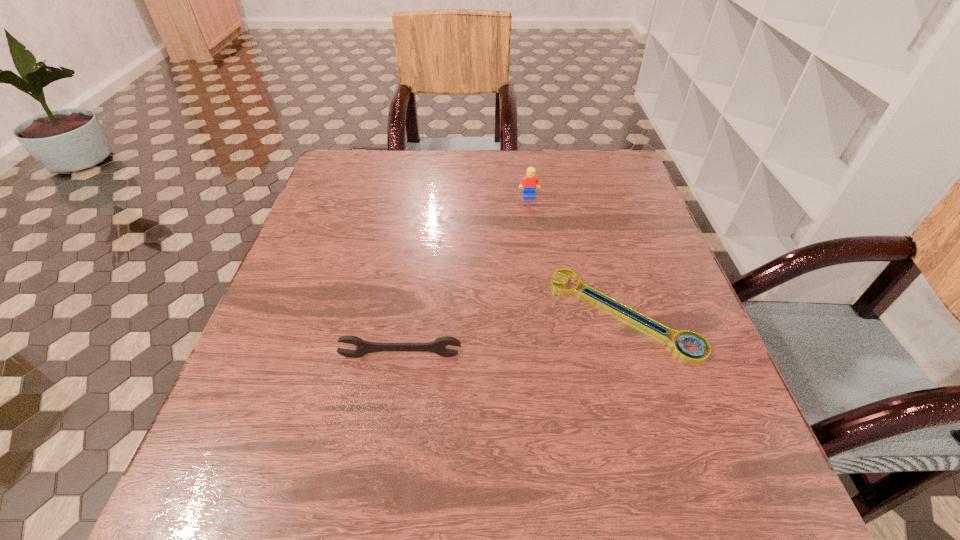
In order to click on object identified as the closest to the tallest object in this screenshot , I will do `click(618, 309)`.

Locate an element on the screen. This screenshot has width=960, height=540. free space that satisfies the following two spatial constraints: 1. on the face of the tallest object; 2. on the right side of the shortest object is located at coordinates (544, 314).

The image size is (960, 540). Identify the location of vacant area in the image that satisfies the following two spatial constraints: 1. on the face of the shorter wrench; 2. on the right side of the Lego. (544, 314).

At what (x,y) coordinates should I click in order to perform the action: click on blank space that satisfies the following two spatial constraints: 1. on the face of the shortest object; 2. on the right side of the tallest object. Please return your answer as a coordinate pair (x, y). This screenshot has width=960, height=540. Looking at the image, I should click on (544, 314).

This screenshot has height=540, width=960. Identify the location of free space that satisfies the following two spatial constraints: 1. on the face of the tallest object; 2. on the right side of the right wrench. (544, 314).